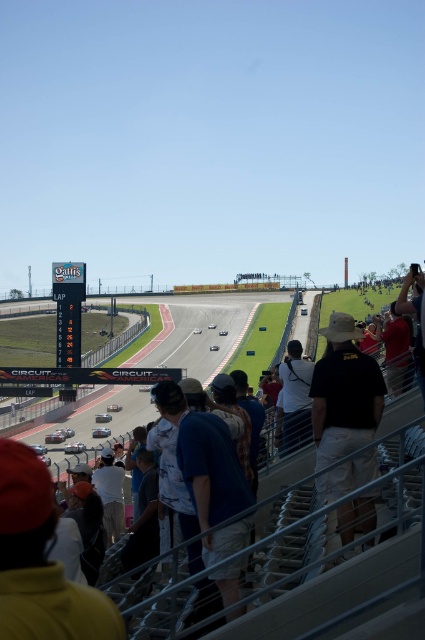
Question: Which object is positioned closest to the black cotton hat at center?

Choices:
 (A) dark gray hoodie at lower left
 (B) white cotton shirt at lower left

Answer: (A)

Question: Which point is farther to the camera?

Choices:
 (A) dark gray hoodie at lower left
 (B) white fabric camera at center

Answer: (B)

Question: Is dark blue shirt at lower center thinner than white fabric camera at center?

Choices:
 (A) no
 (B) yes

Answer: (A)

Question: Which of the following is the closest to the observer?

Choices:
 (A) white cotton shirt at lower left
 (B) dark gray hoodie at lower left
 (C) dark blue shirt at lower center
 (D) white fabric camera at center

Answer: (C)

Question: Is dark blue shirt at lower center below black cotton hat at center?

Choices:
 (A) yes
 (B) no

Answer: (A)

Question: Considering the relative positions of dark blue shirt at lower center and black cotton hat at center in the image provided, where is dark blue shirt at lower center located with respect to black cotton hat at center?

Choices:
 (A) above
 (B) below

Answer: (B)